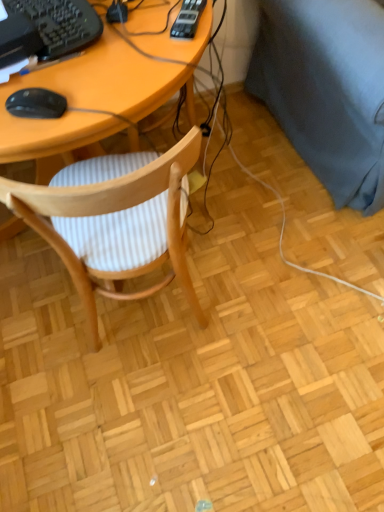
Question: Relative to wooden chair with striped cushion at center, is black plastic keyboard at upper left in front or behind?

Choices:
 (A) front
 (B) behind

Answer: (B)

Question: Is black plastic keyboard at upper left situated inside wooden chair with striped cushion at center or outside?

Choices:
 (A) outside
 (B) inside

Answer: (A)

Question: Which object is the farthest from the black matte mouse at left?

Choices:
 (A) dark blue fabric couch at right
 (B) wooden chair with striped cushion at center
 (C) black plastic keyboard at upper left

Answer: (A)

Question: Based on their relative distances, which object is farther from the black matte mouse at left?

Choices:
 (A) wooden chair with striped cushion at center
 (B) dark blue fabric couch at right
 (C) black plastic keyboard at upper left

Answer: (B)